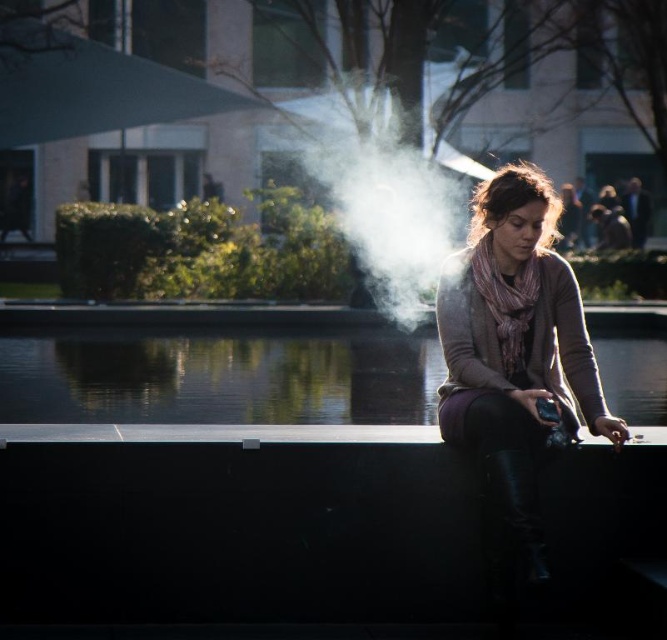
Between black smooth ledge at center and clear glass water at center, which one has less height?

clear glass water at center

The height and width of the screenshot is (640, 667). What do you see at coordinates (241, 528) in the screenshot? I see `black smooth ledge at center` at bounding box center [241, 528].

Is point (183, 564) more distant than point (39, 394)?

No.

The width and height of the screenshot is (667, 640). I want to click on black smooth ledge at center, so click(x=241, y=528).

Is clear glass water at center wider than white vapor at center?

Indeed, clear glass water at center has a greater width compared to white vapor at center.

Is point (402, 355) behind point (444, 189)?

That is False.

Does point (87, 333) come farther from viewer compared to point (452, 179)?

No.

Find the location of a particular element. The height and width of the screenshot is (640, 667). clear glass water at center is located at coordinates (217, 376).

Who is shorter, black smooth ledge at center or white vapor at center?

Standing shorter between the two is black smooth ledge at center.

Does black smooth ledge at center have a lesser height compared to white vapor at center?

Yes.

Who is more distant from viewer, (81, 620) or (458, 205)?

The point (458, 205) is more distant.

Locate an element on the screen. The image size is (667, 640). black smooth ledge at center is located at coordinates (241, 528).